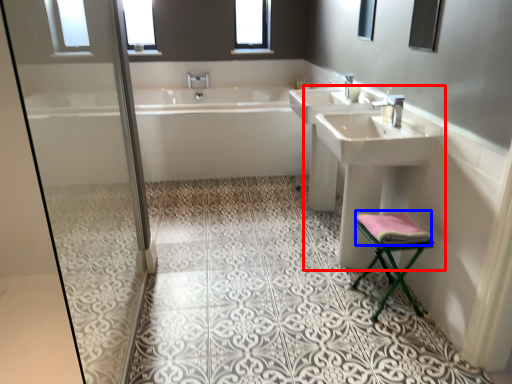
Question: Which point is closer to the camera, sink (highlighted by a red box) or material (highlighted by a blue box)?

Choices:
 (A) sink
 (B) material

Answer: (B)